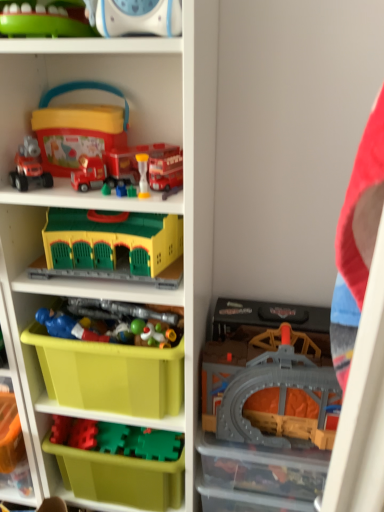
Question: Is yellow plastic building at center, which ranks as the fifth toy in bottom-to-top order, inside the boundaries of translucent plastic tunnel at lower right, which is counted as the first storage box, starting from the right, or outside?

Choices:
 (A) outside
 (B) inside

Answer: (A)

Question: From a real-world perspective, is yellow plastic building at center, the 3th toy in the top-to-bottom sequence, physically located above or below translucent plastic tunnel at lower right, positioned as the second storage box in left-to-right order?

Choices:
 (A) above
 (B) below

Answer: (A)

Question: Considering the real-world distances, which object is closest to the translucent plastic toy at center, the sixth toy in the top-to-bottom sequence?

Choices:
 (A) yellow plastic building at center, which ranks as the fifth toy in bottom-to-top order
 (B) gray plastic train track at center-right, which is the 1th toy in bottom-to-top order
 (C) matte red truck at upper left, the seventh toy when ordered from bottom to top
 (D) translucent plastic tunnel at lower right, positioned as the second storage box in left-to-right order
 (E) translucent plastic hourglass at upper center, the sixth toy ordered from the bottom

Answer: (A)

Question: Which object is positioned closest to the translucent plastic toy at center, the 2th toy when ordered from bottom to top?

Choices:
 (A) translucent plastic toy at center, which appears as the 4th toy when viewed from the top
 (B) yellow plastic building at center, the 3th toy in the top-to-bottom sequence
 (C) blue plastic figure at center, the fifth toy from the top
 (D) green plastic storage box at lower center, which is counted as the 2th storage box, starting from the right
 (E) matte red truck at upper left, the seventh toy when ordered from bottom to top

Answer: (A)